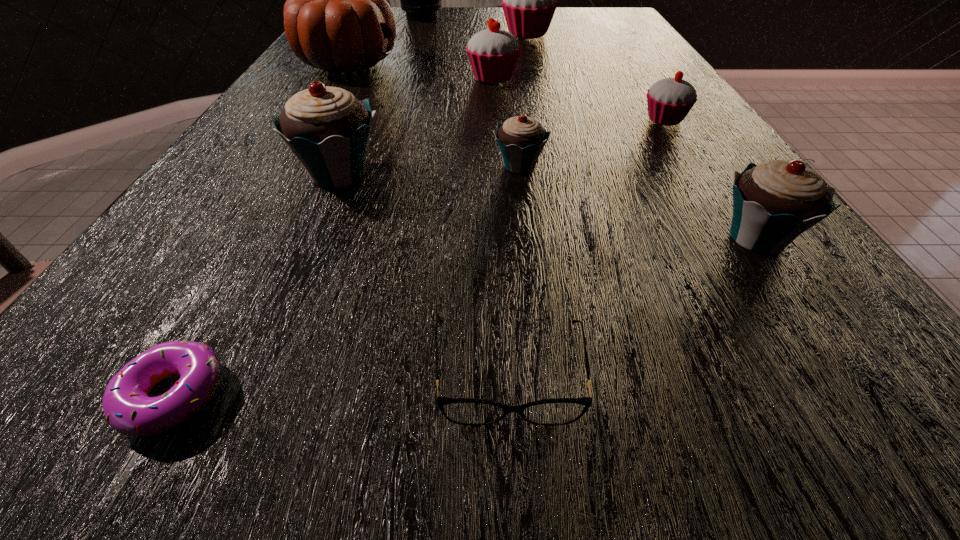
Locate which cupcake ranks fourth in proximity to the smallest teal cupcake. Please provide its 2D coordinates. Your answer should be formatted as a tuple, i.e. [(x, y)], where the tuple contains the x and y coordinates of a point satisfying the conditions above.

[(493, 53)]

I want to click on cupcake that is the fifth nearest to the smallest teal cupcake, so click(x=529, y=0).

Locate which pink cupcake ranks third in proximity to the black telephoto lens. Please provide its 2D coordinates. Your answer should be formatted as a tuple, i.e. [(x, y)], where the tuple contains the x and y coordinates of a point satisfying the conditions above.

[(669, 100)]

What are the coordinates of `pink cupcake that is the second closest to the fifth nearest cupcake` in the screenshot? It's located at (669, 100).

Identify which teal cupcake is the second nearest to the ninth tallest object. Please provide its 2D coordinates. Your answer should be formatted as a tuple, i.e. [(x, y)], where the tuple contains the x and y coordinates of a point satisfying the conditions above.

[(328, 129)]

Where is `teal cupcake object that ranks as the closest to the black telephoto lens`? teal cupcake object that ranks as the closest to the black telephoto lens is located at coordinates (x=328, y=129).

At what (x,y) coordinates should I click in order to perform the action: click on vacant area that satisfies the following two spatial constraints: 1. on the front side of the nearest pink cupcake; 2. on the right side of the second smallest teal cupcake. Please return your answer as a coordinate pair (x, y). Looking at the image, I should click on (741, 238).

Locate an element on the screen. This screenshot has height=540, width=960. free location that satisfies the following two spatial constraints: 1. on the face of the orange pumpkin; 2. on the left side of the smallest pink cupcake is located at coordinates (316, 120).

You are a GUI agent. You are given a task and a screenshot of the screen. Output one action in this format:
    pyautogui.click(x=<x>, y=<y>)
    Task: Click on the blank area in the image that satisfies the following two spatial constraints: 1. on the front side of the smallest teal cupcake; 2. on the left side of the second biggest teal cupcake
    
    Given the screenshot: What is the action you would take?
    pyautogui.click(x=528, y=238)

At what (x,y) coordinates should I click in order to perform the action: click on blank area in the image that satisfies the following two spatial constraints: 1. on the back side of the second farthest object; 2. on the right side of the second farthest cupcake. Please return your answer as a coordinate pair (x, y). The width and height of the screenshot is (960, 540). Looking at the image, I should click on (491, 34).